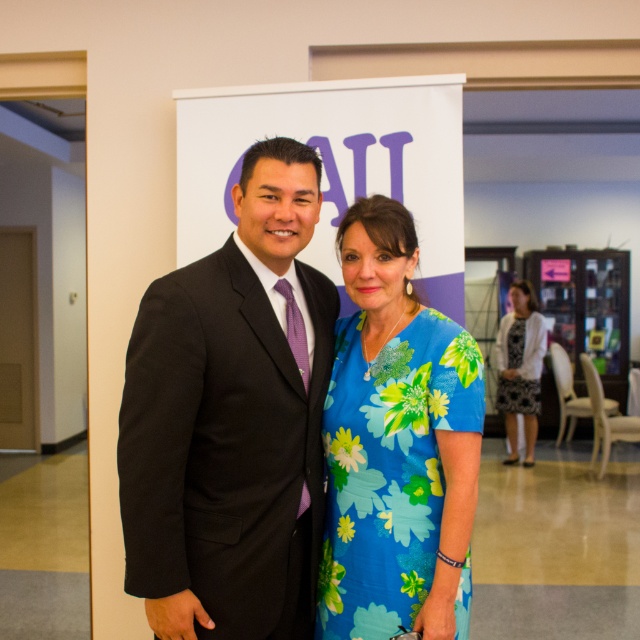
You are a photographer setting up for a group photo. You need to arrange the matte black suit at center and the black floral dress at right so that both subjects are visible in the frame. Given their height difference, which subject should you position closer to the camera to ensure their faces are equally visible?

The matte black suit at center is much taller than the black floral dress at right. To ensure both faces are equally visible, position the black floral dress at right closer to the camera since they are shorter.

You are standing at the camera position and want to place a small decoration exactly 5 feet away from where you are. There is a point marked at coordinates point (355, 429). Can you use this point as the location for the decoration?

The point (355, 429) is 5.59 feet from the camera, so it is slightly further than the desired 5 feet. You might need to move the decoration a little closer to the camera to meet the 5 feet requirement.